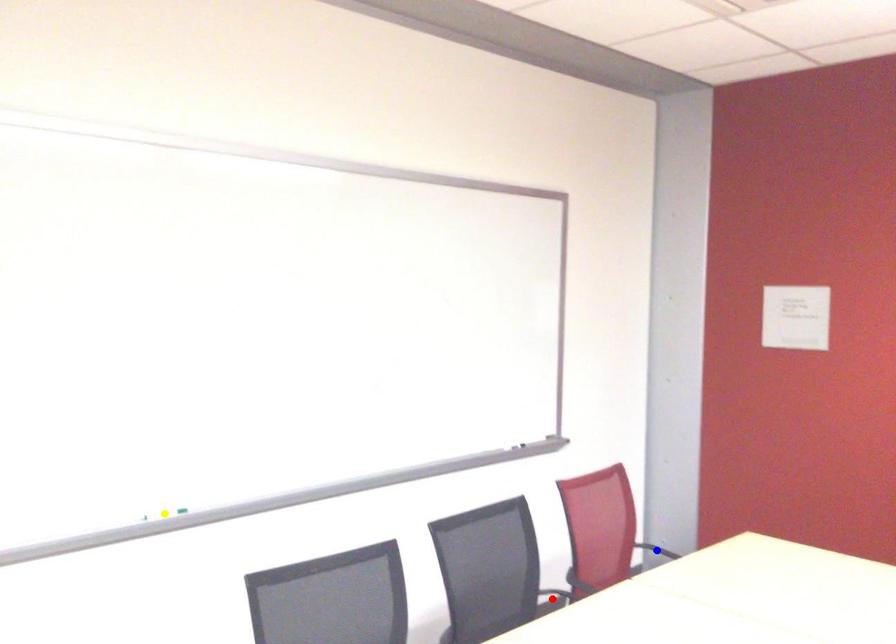
Consider the image. Order these from nearest to farthest:
1. yellow point
2. blue point
3. red point

blue point
red point
yellow point